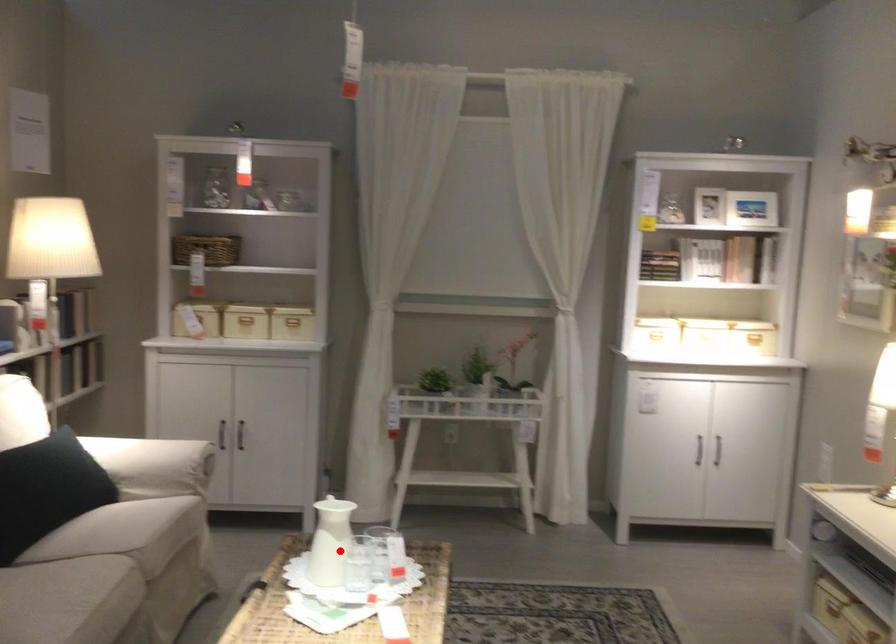
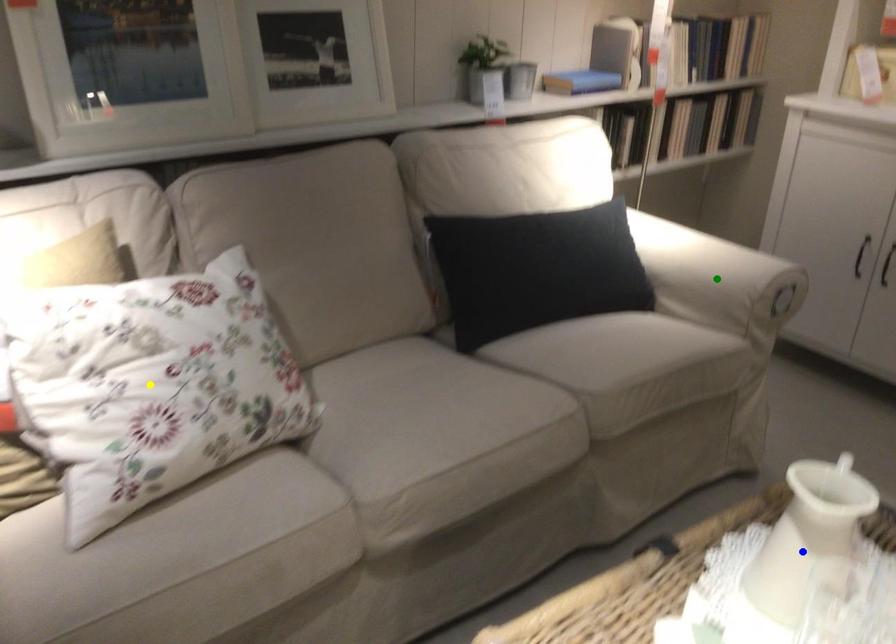
Question: I am providing you with two images of the same scene from different viewpoints. A red point is marked on the first image. You are given multiple points on the second image. Which mark in image 2 goes with the point in image 1?

Choices:
 (A) blue point
 (B) yellow point
 (C) green point

Answer: (A)